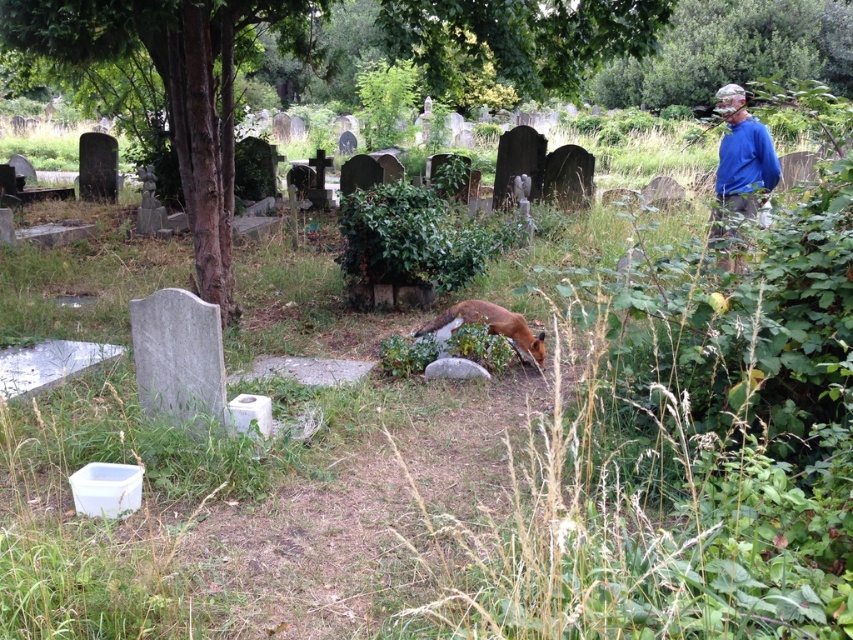
Question: In this image, where is brown textured tree at center located relative to blue cotton shirt at upper right?

Choices:
 (A) left
 (B) right

Answer: (A)

Question: Which object appears farthest from the camera in this image?

Choices:
 (A) blue cotton shirt at upper right
 (B) brown textured tree at center

Answer: (A)

Question: Can you confirm if brown textured tree at center is positioned below blue cotton shirt at upper right?

Choices:
 (A) no
 (B) yes

Answer: (B)

Question: Which is farther from the brown fur fox at center?

Choices:
 (A) blue cotton shirt at upper right
 (B) green leafy tree at upper right
 (C) brown textured tree at center

Answer: (B)

Question: Is green leafy tree at upper right above brown fur fox at center?

Choices:
 (A) no
 (B) yes

Answer: (B)

Question: Based on their relative distances, which object is nearer to the green leafy tree at upper right?

Choices:
 (A) brown textured tree at center
 (B) blue cotton shirt at upper right
 (C) brown fur fox at center

Answer: (C)